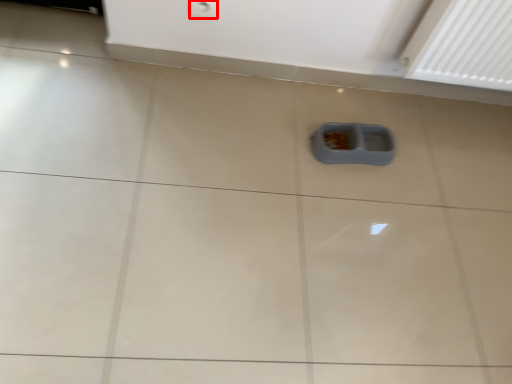
Question: In this image, where is electric outlet (annotated by the red box) located relative to waste container?

Choices:
 (A) left
 (B) right

Answer: (A)